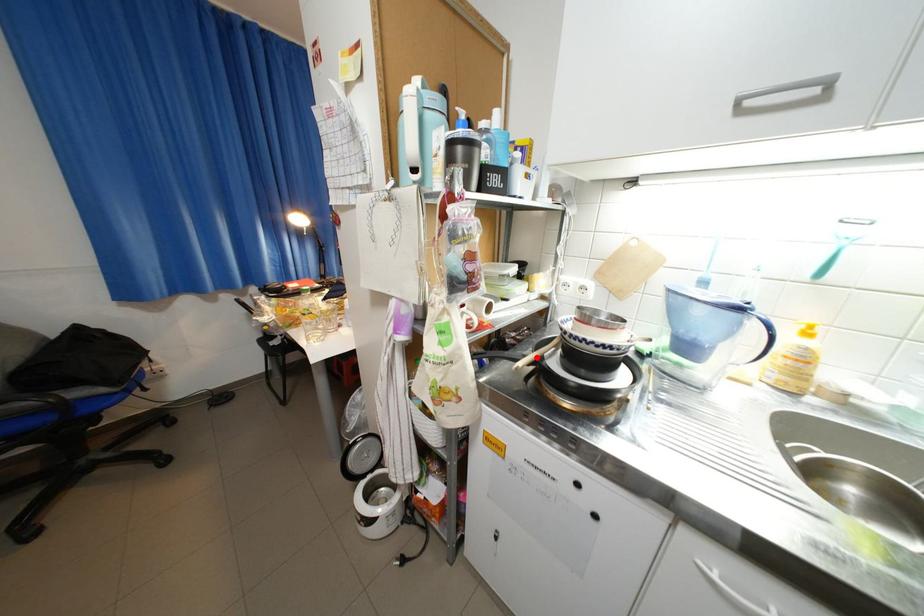
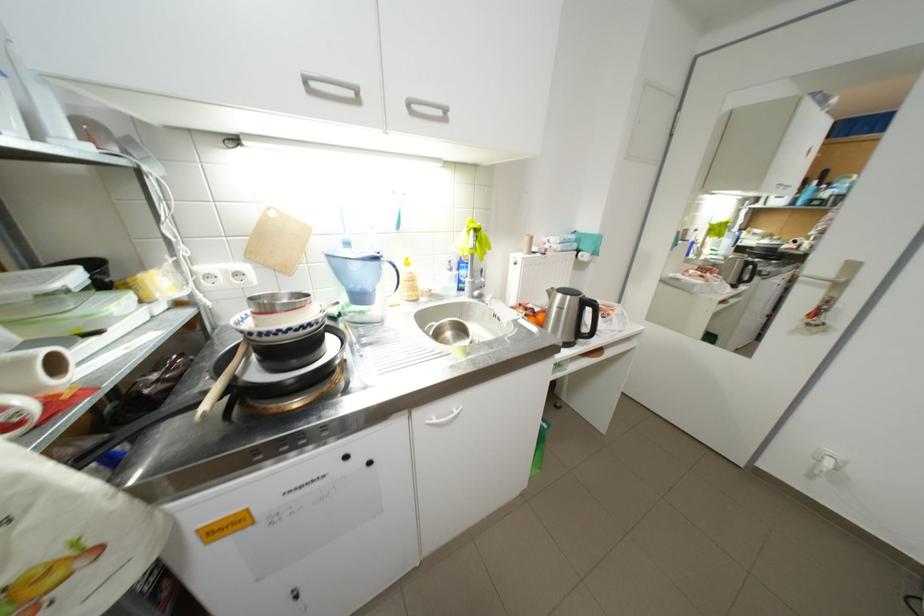
Locate, in the second image, the point that corresponds to the highlighted location in the first image.

(215, 394)